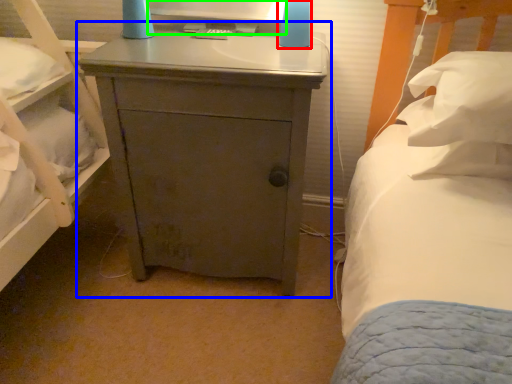
Question: Estimate the real-world distances between objects in this image. Which object is closer to bedside lamp (highlighted by a red box), nightstand (highlighted by a blue box) or computer monitor (highlighted by a green box)?

Choices:
 (A) nightstand
 (B) computer monitor

Answer: (B)